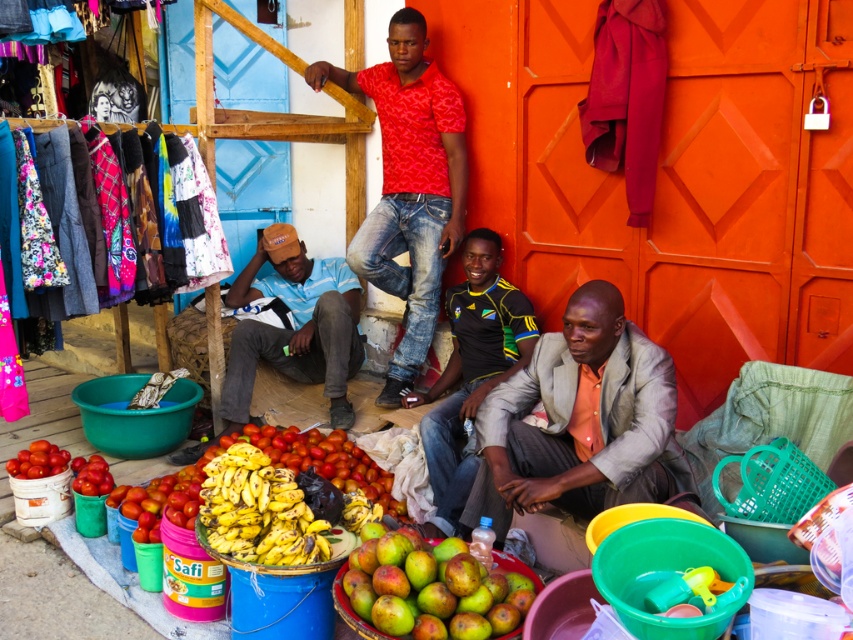
Question: Can you confirm if yellow-green jersey at center is wider than shiny red tomatoes at lower left?

Choices:
 (A) no
 (B) yes

Answer: (B)

Question: Does red printed shirt at center appear over yellow matte bananas at center?

Choices:
 (A) yes
 (B) no

Answer: (A)

Question: Which point is closer to the camera?

Choices:
 (A) (482, 474)
 (B) (399, 570)
 (C) (339, 348)

Answer: (B)

Question: Which object is the farthest from the shiny red tomatoes at lower left?

Choices:
 (A) shiny yellow bananas at center
 (B) yellow-green jersey at center
 (C) yellow matte bananas at center
 (D) orange fabric jacket at lower center

Answer: (D)

Question: Does orange fabric jacket at lower center have a larger size compared to red printed shirt at center?

Choices:
 (A) no
 (B) yes

Answer: (A)

Question: Which point is farther to the camera?

Choices:
 (A) yellow-green jersey at center
 (B) orange fabric jacket at lower center
 (C) shiny red tomatoes at lower left
 (D) yellow matte bananas at center

Answer: (C)